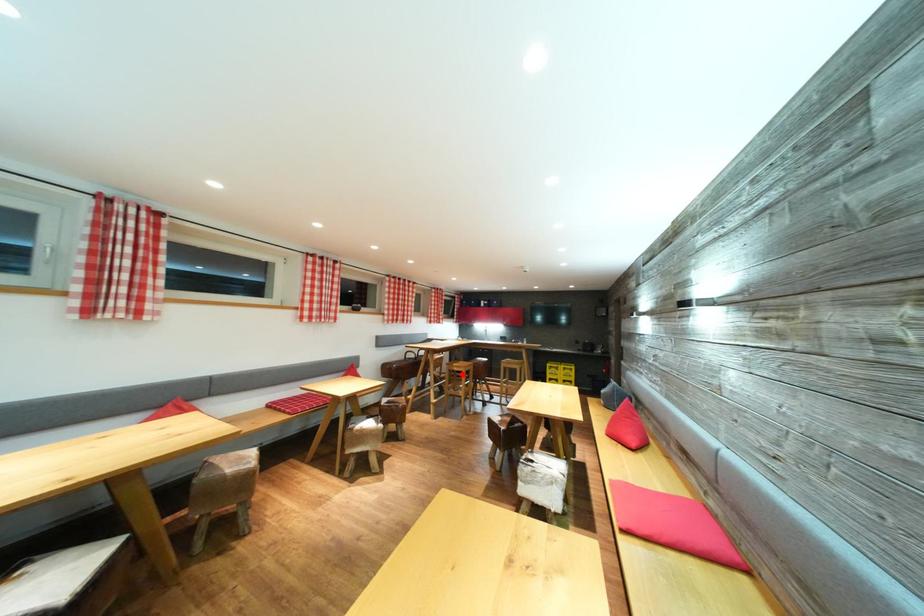
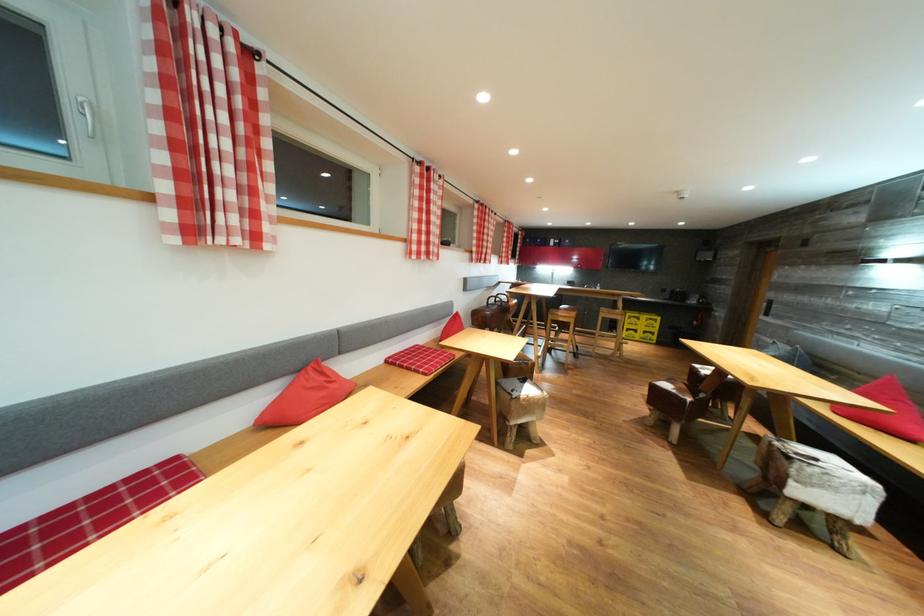
Find the pixel in the second image that matches the highlighted location in the first image.

(567, 325)